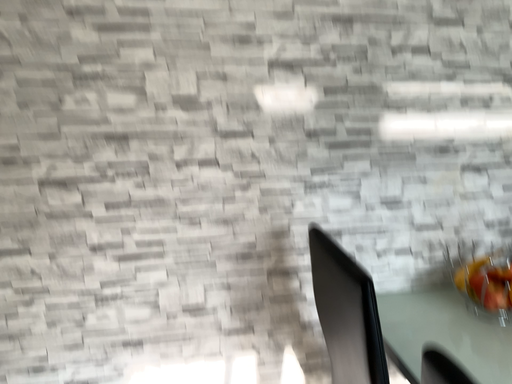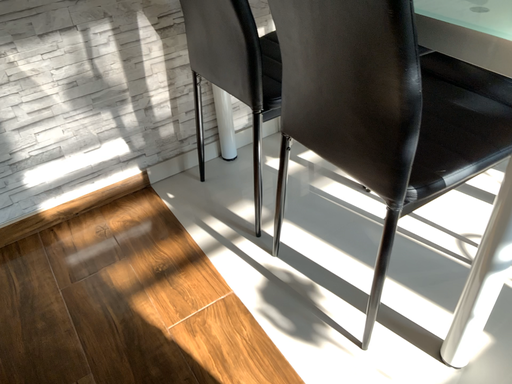
Question: How did the camera likely rotate when shooting the video?

Choices:
 (A) rotated downward
 (B) rotated upward

Answer: (A)